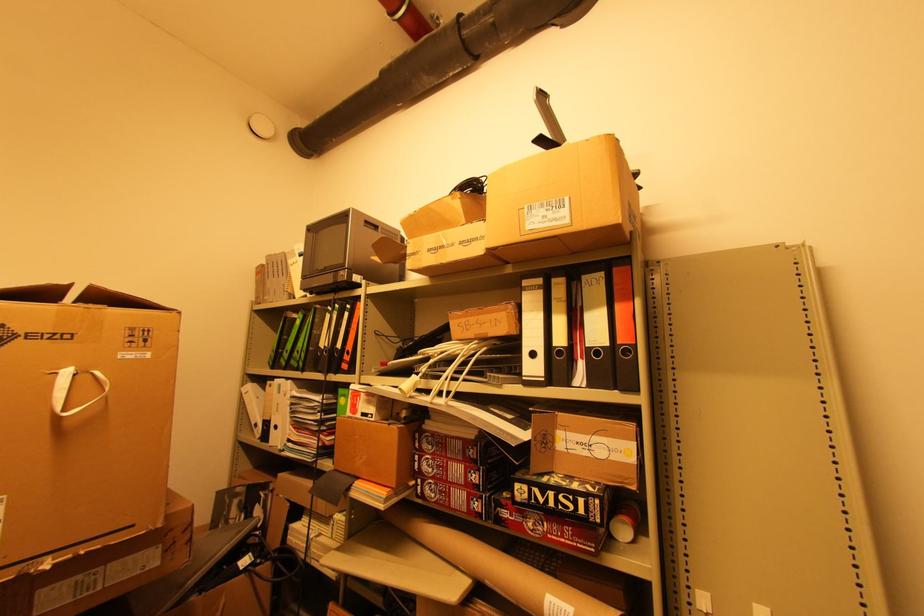
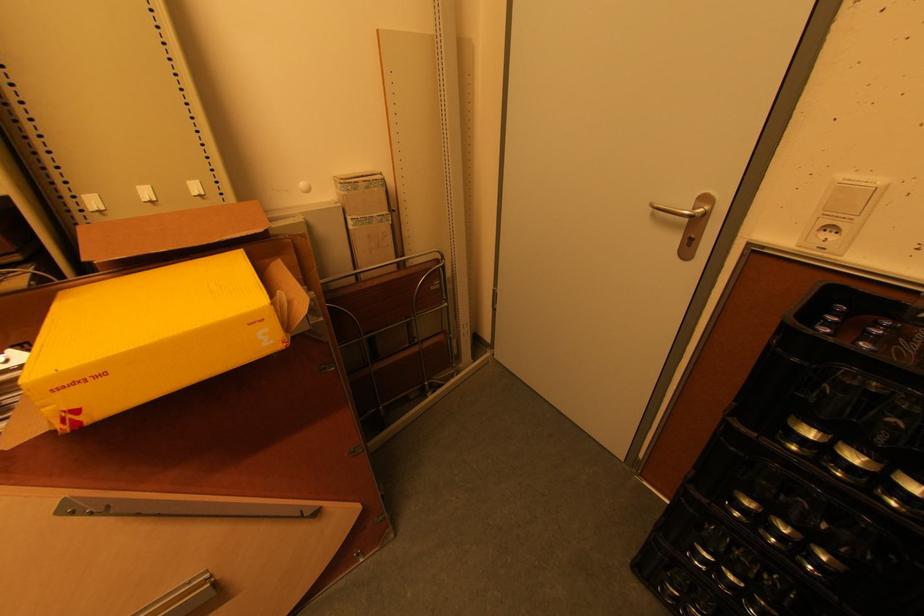
The images are taken continuously from a first-person perspective. In which direction is your viewpoint rotating?

The camera's rotation is toward right-down.